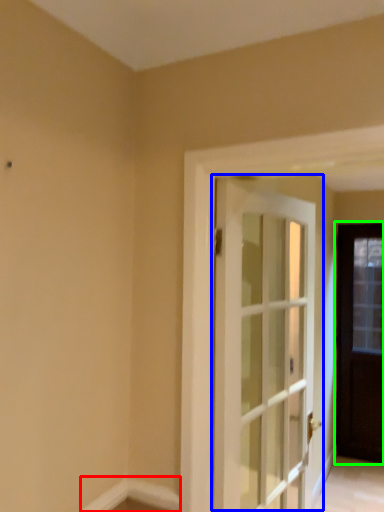
Question: Which object is positioned farthest from molding (highlighted by a red box)? Select from door (highlighted by a blue box) and door (highlighted by a green box).

Choices:
 (A) door
 (B) door

Answer: (B)